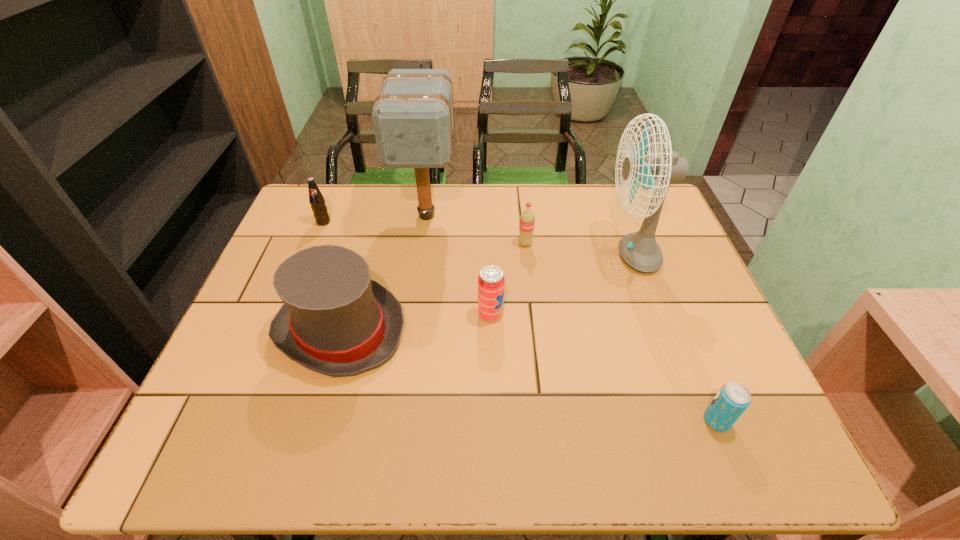
This screenshot has height=540, width=960. What are the coordinates of `fan located at the far edge` in the screenshot? It's located at (639, 250).

The width and height of the screenshot is (960, 540). Find the location of `pop located at the far edge`. pop located at the far edge is located at coordinates (316, 199).

You are a GUI agent. You are given a task and a screenshot of the screen. Output one action in this format:
    pyautogui.click(x=<x>, y=<y>)
    Task: Click on the object located at the near edge
    The image size is (960, 540).
    Given the screenshot: What is the action you would take?
    pyautogui.click(x=733, y=398)

Where is `dress hat that is at the left edge`? dress hat that is at the left edge is located at coordinates (335, 320).

The image size is (960, 540). I want to click on pop positioned at the left edge, so click(316, 199).

You are a GUI agent. You are given a task and a screenshot of the screen. Output one action in this format:
    pyautogui.click(x=<x>, y=<y>)
    Task: Click on the fan at the right edge
    The height and width of the screenshot is (540, 960).
    Given the screenshot: What is the action you would take?
    pyautogui.click(x=639, y=250)

This screenshot has height=540, width=960. I want to click on soda can located in the right edge section of the desktop, so click(x=733, y=398).

Locate an element on the screen. The height and width of the screenshot is (540, 960). object that is at the far left corner is located at coordinates (316, 199).

The width and height of the screenshot is (960, 540). Find the location of `object at the far right corner`. object at the far right corner is located at coordinates (639, 250).

You are a GUI agent. You are given a task and a screenshot of the screen. Output one action in this format:
    pyautogui.click(x=<x>, y=<y>)
    Task: Click on the object present at the near right corner
    The height and width of the screenshot is (540, 960).
    Given the screenshot: What is the action you would take?
    pyautogui.click(x=733, y=398)